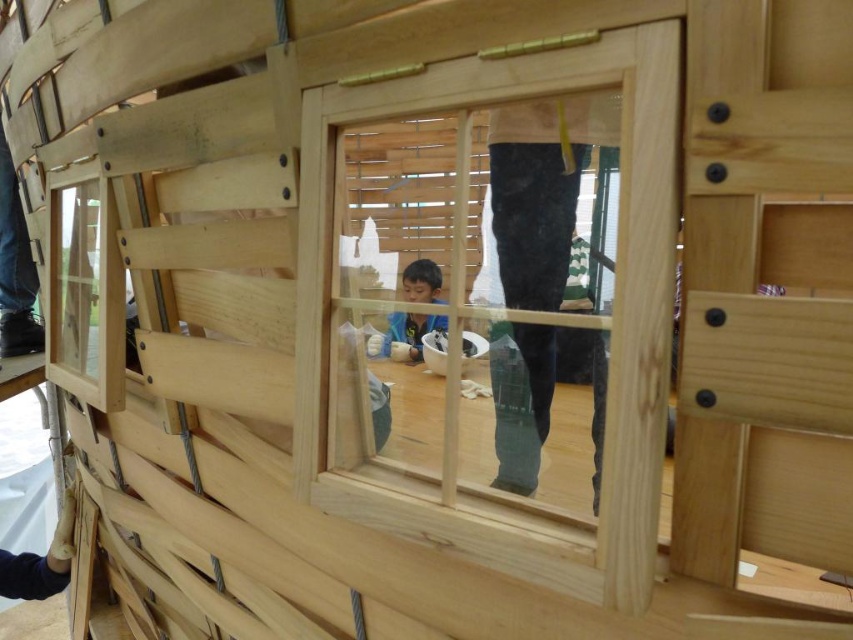
Between clear glass window at center and smooth wooden boy at center, which one is positioned lower?

smooth wooden boy at center is below.

Does clear glass window at center have a larger size compared to smooth wooden boy at center?

Yes, clear glass window at center is bigger than smooth wooden boy at center.

This screenshot has height=640, width=853. Find the location of `clear glass window at center`. clear glass window at center is located at coordinates (541, 189).